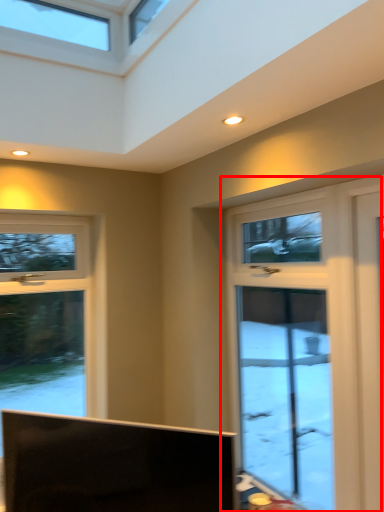
Question: Observing the image, what is the correct spatial positioning of window (annotated by the red box) in reference to television?

Choices:
 (A) right
 (B) left

Answer: (A)